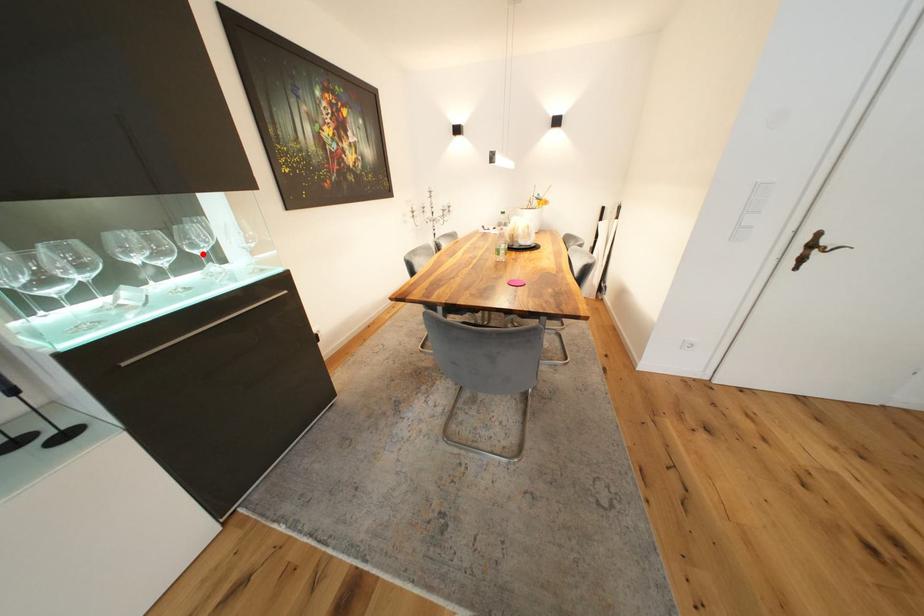
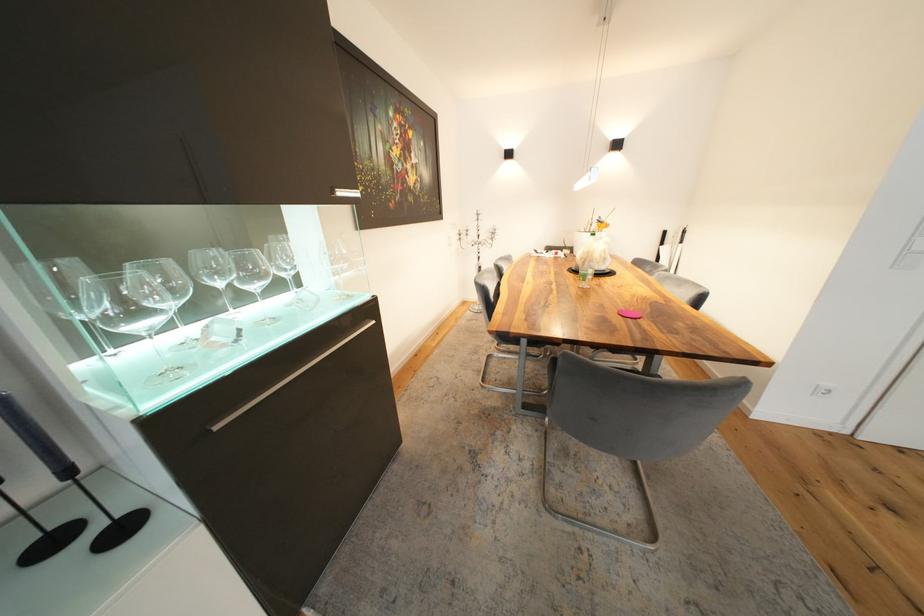
Where in the second image is the point corresponding to the highlighted location from the first image?

(290, 276)